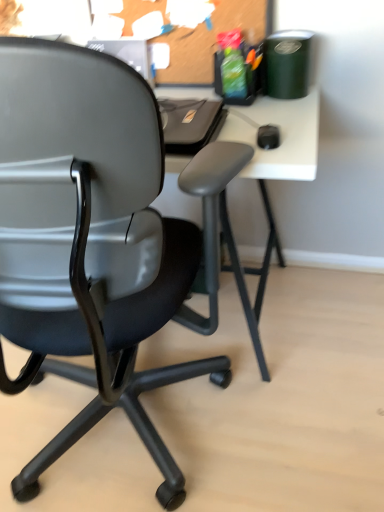
Question: Is point (9, 56) positioned closer to the camera than point (173, 66)?

Choices:
 (A) closer
 (B) farther

Answer: (A)

Question: Based on their positions, is matte black chair at left located to the left or right of burlap corkboard at upper center?

Choices:
 (A) right
 (B) left

Answer: (B)

Question: Is matte black chair at left inside or outside of burlap corkboard at upper center?

Choices:
 (A) inside
 (B) outside

Answer: (B)

Question: From a real-world perspective, is burlap corkboard at upper center positioned above or below matte black chair at left?

Choices:
 (A) above
 (B) below

Answer: (A)

Question: Is burlap corkboard at upper center in front of or behind matte black chair at left in the image?

Choices:
 (A) behind
 (B) front

Answer: (A)

Question: In terms of height, does burlap corkboard at upper center look taller or shorter compared to matte black chair at left?

Choices:
 (A) short
 (B) tall

Answer: (A)

Question: Considering the positions of point [140, 2] and point [183, 283], is point [140, 2] closer or farther from the camera than point [183, 283]?

Choices:
 (A) farther
 (B) closer

Answer: (A)